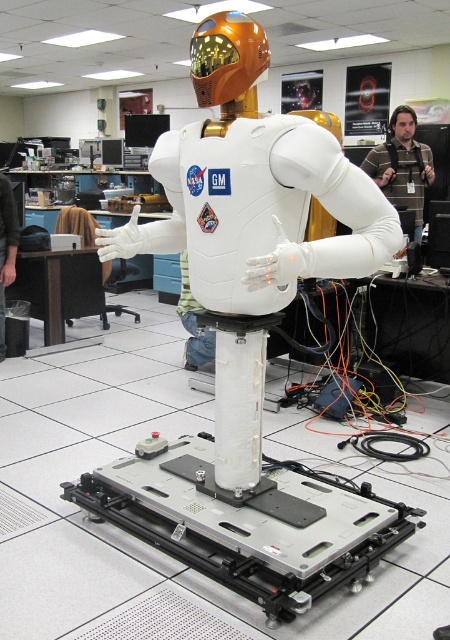
You are a technician standing in front of the robot. You need to reach the brown striped shirt at center to adjust its position. Considering your arm length is 2.5 feet, can you reach it without moving closer?

The brown striped shirt at center is 14.53 feet away from you. Since your arm length is only 2.5 feet, you cannot reach it without moving closer.

You are a fashion designer observing the humanoid robot in the laboratory. You notice the brown striped shirt at center and the dark gray fabric shirt at lower left. Which shirt would you say is larger in size?

The brown striped shirt at center is bigger than the dark gray fabric shirt at lower left, so the brown striped shirt at center is larger in size.

You are a technician working in the lab. You need to place a new component on the metallic silver platform at center. Where exactly should you place it?

The metallic silver platform at center is located at point (250, 524), so place the component there.